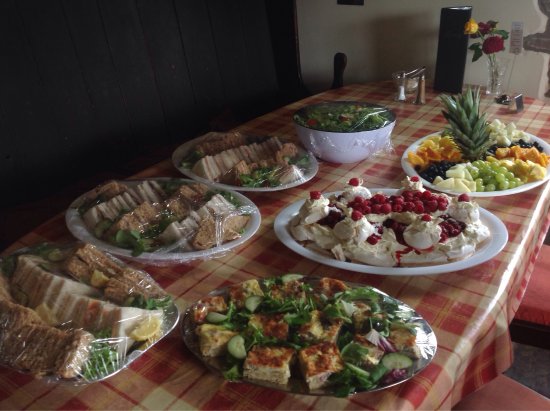
This screenshot has width=550, height=411. I want to click on table cloth, so tap(150, 390), tap(253, 253), tap(385, 155), tap(434, 92), tap(547, 110).